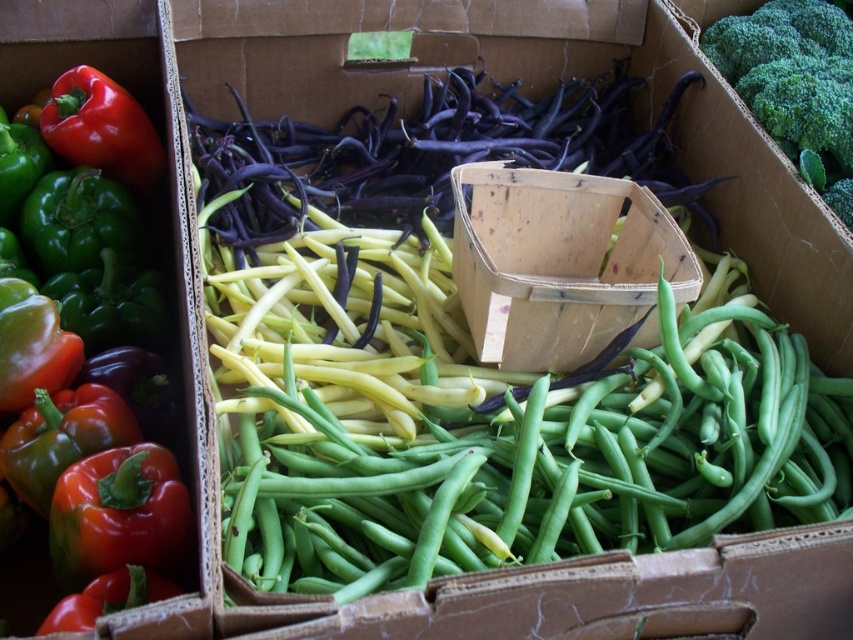
Question: Is green matte bell pepper at left positioned at the back of green leafy broccoli at upper right?

Choices:
 (A) no
 (B) yes

Answer: (A)

Question: Which object appears farthest from the camera in this image?

Choices:
 (A) green matte bell pepper at left
 (B) green leafy broccoli at upper right

Answer: (B)

Question: Which of the following is the closest to the observer?

Choices:
 (A) green matte bell pepper at left
 (B) green leafy broccoli at upper right

Answer: (A)

Question: Is green matte bell pepper at left below green leafy broccoli at upper right?

Choices:
 (A) yes
 (B) no

Answer: (A)

Question: Which object is closer to the camera taking this photo?

Choices:
 (A) green leafy broccoli at upper right
 (B) green matte bell pepper at left

Answer: (B)

Question: Is green matte bell pepper at left to the right of green leafy broccoli at upper right from the viewer's perspective?

Choices:
 (A) yes
 (B) no

Answer: (B)